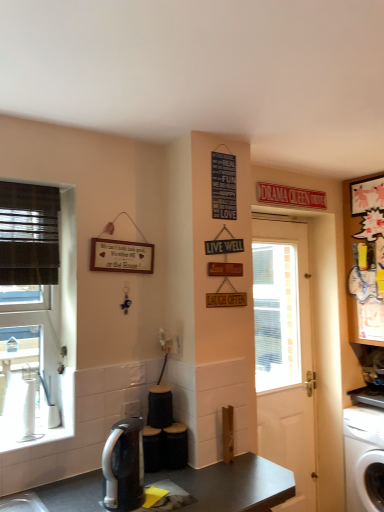
Locate an element on the screen. The image size is (384, 512). dark gray laminate desk at center is located at coordinates (233, 485).

Find the location of a particular element. This screenshot has width=384, height=512. white matte door at center is located at coordinates (286, 358).

Locate an element on the screen. This screenshot has width=384, height=512. cartoon paper cutout at upper right is located at coordinates click(x=365, y=257).

Is white matte door at center further to camera compared to sleek silver coffee maker at lower center?

Yes, white matte door at center is behind sleek silver coffee maker at lower center.

Is sleek silver coffee maker at lower center surrounded by white matte door at center?

No, sleek silver coffee maker at lower center is located outside of white matte door at center.

Who is shorter, white matte door at center or sleek silver coffee maker at lower center?

Standing shorter between the two is sleek silver coffee maker at lower center.

Which point is more forward, (294, 422) or (135, 485)?

A: The point (135, 485) is closer.

In the scene shown: Is the surface of white plastic washing machine at lower right in direct contact with dark gray laminate desk at center?

There is a gap between white plastic washing machine at lower right and dark gray laminate desk at center.

From the picture: Could you tell me if white plastic washing machine at lower right is facing dark gray laminate desk at center?

Yes.

Can you confirm if white plastic washing machine at lower right is thinner than dark gray laminate desk at center?

Indeed, white plastic washing machine at lower right has a lesser width compared to dark gray laminate desk at center.

Does point (370, 431) lie behind point (66, 507)?

That is True.

From the image's perspective, is white matte door at center on top of cartoon paper cutout at upper right?

No, from the image's perspective, white matte door at center is not above cartoon paper cutout at upper right.

Considering the relative positions of white matte door at center and cartoon paper cutout at upper right in the image provided, is white matte door at center to the right of cartoon paper cutout at upper right from the viewer's perspective?

No.

Is point (257, 242) closer or farther from the camera than point (370, 200)?

Point (257, 242) is positioned farther from the camera compared to point (370, 200).

Is white matte door at center beside cartoon paper cutout at upper right?

No, white matte door at center is not touching cartoon paper cutout at upper right.

Between sleek silver coffee maker at lower center and cartoon paper cutout at upper right, which one appears on the right side from the viewer's perspective?

cartoon paper cutout at upper right is more to the right.

Considering the relative sizes of sleek silver coffee maker at lower center and cartoon paper cutout at upper right in the image provided, is sleek silver coffee maker at lower center taller than cartoon paper cutout at upper right?

No, sleek silver coffee maker at lower center is not taller than cartoon paper cutout at upper right.

How much distance is there between sleek silver coffee maker at lower center and cartoon paper cutout at upper right?

sleek silver coffee maker at lower center is 1.82 meters from cartoon paper cutout at upper right.

From a real-world perspective, does sleek silver coffee maker at lower center sit lower than cartoon paper cutout at upper right?

Indeed, from a real-world perspective, sleek silver coffee maker at lower center is positioned beneath cartoon paper cutout at upper right.

Is white matte door at center surrounding dark gray laminate desk at center?

No, white matte door at center does not contain dark gray laminate desk at center.

Considering the relative positions of white matte door at center and dark gray laminate desk at center in the image provided, is white matte door at center in front of dark gray laminate desk at center?

No, the depth of white matte door at center is greater than that of dark gray laminate desk at center.

Consider the image. Considering the sizes of white matte door at center and dark gray laminate desk at center in the image, is white matte door at center wider or thinner than dark gray laminate desk at center?

Clearly, white matte door at center has less width compared to dark gray laminate desk at center.

From the image's perspective, which is below, white matte door at center or dark gray laminate desk at center?

From the image's view, dark gray laminate desk at center is below.

Is cartoon paper cutout at upper right facing away from white plastic washing machine at lower right?

No, cartoon paper cutout at upper right is not facing the opposite direction of white plastic washing machine at lower right.

Is cartoon paper cutout at upper right located outside white plastic washing machine at lower right?

Yes.

Looking at their sizes, would you say cartoon paper cutout at upper right is wider or thinner than white plastic washing machine at lower right?

Considering their sizes, cartoon paper cutout at upper right looks slimmer than white plastic washing machine at lower right.

How much distance is there between cartoon paper cutout at upper right and white plastic washing machine at lower right?

The distance of cartoon paper cutout at upper right from white plastic washing machine at lower right is 31.58 inches.

Is cartoon paper cutout at upper right wider or thinner than sleek silver coffee maker at lower center?

Clearly, cartoon paper cutout at upper right has more width compared to sleek silver coffee maker at lower center.

The height and width of the screenshot is (512, 384). I want to click on cabinetry on the right side of sleek silver coffee maker at lower center, so click(365, 257).

Is point (362, 231) closer or farther from the camera than point (121, 457)?

Clearly, point (362, 231) is more distant from the camera than point (121, 457).

Is cartoon paper cutout at upper right located outside sleek silver coffee maker at lower center?

Yes, cartoon paper cutout at upper right is outside of sleek silver coffee maker at lower center.

Where is `door behind the sleek silver coffee maker at lower center`? The height and width of the screenshot is (512, 384). door behind the sleek silver coffee maker at lower center is located at coordinates (286, 358).

The width and height of the screenshot is (384, 512). I want to click on desk lying on the left of white plastic washing machine at lower right, so click(233, 485).

When comparing their distances from white matte door at center, does sleek silver coffee maker at lower center or white plastic washing machine at lower right seem further?

sleek silver coffee maker at lower center is positioned further to the anchor white matte door at center.

Consider the image. Estimate the real-world distances between objects in this image. Which object is further from dark gray laminate desk at center, white plastic washing machine at lower right or white matte door at center?

Among the two, white plastic washing machine at lower right is located further to dark gray laminate desk at center.

Based on the photo, from the image, which object appears to be nearer to cartoon paper cutout at upper right, dark gray laminate desk at center or sleek silver coffee maker at lower center?

dark gray laminate desk at center is positioned closer to the anchor cartoon paper cutout at upper right.

Based on their spatial positions, is dark gray laminate desk at center or white matte door at center closer to sleek silver coffee maker at lower center?

Among the two, dark gray laminate desk at center is located nearer to sleek silver coffee maker at lower center.

Looking at the image, which one is located closer to white plastic washing machine at lower right, dark gray laminate desk at center or white matte door at center?

white matte door at center lies closer to white plastic washing machine at lower right than the other object.

Estimate the real-world distances between objects in this image. Which object is closer to white matte door at center, cartoon paper cutout at upper right or white plastic washing machine at lower right?

white plastic washing machine at lower right.

From the image, which object appears to be nearer to dark gray laminate desk at center, cartoon paper cutout at upper right or sleek silver coffee maker at lower center?

Among the two, sleek silver coffee maker at lower center is located nearer to dark gray laminate desk at center.

From the picture: From the image, which object appears to be nearer to sleek silver coffee maker at lower center, cartoon paper cutout at upper right or dark gray laminate desk at center?

Based on the image, dark gray laminate desk at center appears to be nearer to sleek silver coffee maker at lower center.

At what (x,y) coordinates should I click in order to perform the action: click on washing machine between dark gray laminate desk at center and cartoon paper cutout at upper right in the front-back direction. Please return your answer as a coordinate pair (x, y). Image resolution: width=384 pixels, height=512 pixels. Looking at the image, I should click on (364, 458).

At what (x,y) coordinates should I click in order to perform the action: click on coffee maker positioned between dark gray laminate desk at center and white matte door at center from near to far. Please return your answer as a coordinate pair (x, y). Looking at the image, I should click on (124, 466).

Image resolution: width=384 pixels, height=512 pixels. Find the location of `door that lies between cartoon paper cutout at upper right and white plastic washing machine at lower right from top to bottom`. door that lies between cartoon paper cutout at upper right and white plastic washing machine at lower right from top to bottom is located at coordinates [286, 358].

You are a GUI agent. You are given a task and a screenshot of the screen. Output one action in this format:
    pyautogui.click(x=<x>, y=<y>)
    Task: Click on the door between sleek silver coffee maker at lower center and white plastic washing machine at lower right in the horizontal direction
    
    Given the screenshot: What is the action you would take?
    pyautogui.click(x=286, y=358)